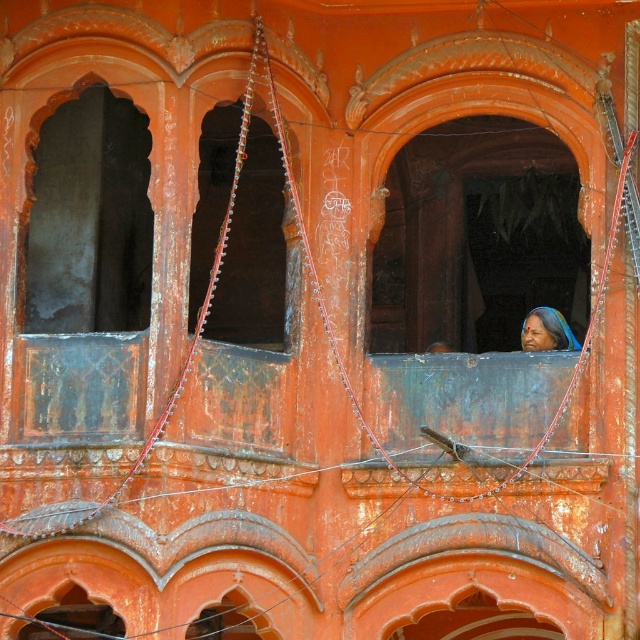
You are an architect analyzing the building facade. You notice the dark brown wooden window at center and the matte blue sari at center. Which object is positioned to the right side of the other?

The dark brown wooden window at center is to the left of matte blue sari at center, so the matte blue sari at center is positioned to the right side of the dark brown wooden window at center.

Based on the scene description, where is the dark gray stone arch at left located in the image?

The dark gray stone arch at left is located at point (90, 218).

You are an architect designing a new building inspired by traditional Indian architecture. You want to ensure the dark gray stone arch at left and the matte blue sari at center are proportionally balanced. Given their sizes, which object should you scale down to achieve this balance?

The dark gray stone arch at left is much taller than the matte blue sari at center, so you should scale down the dark gray stone arch at left to achieve proportional balance.